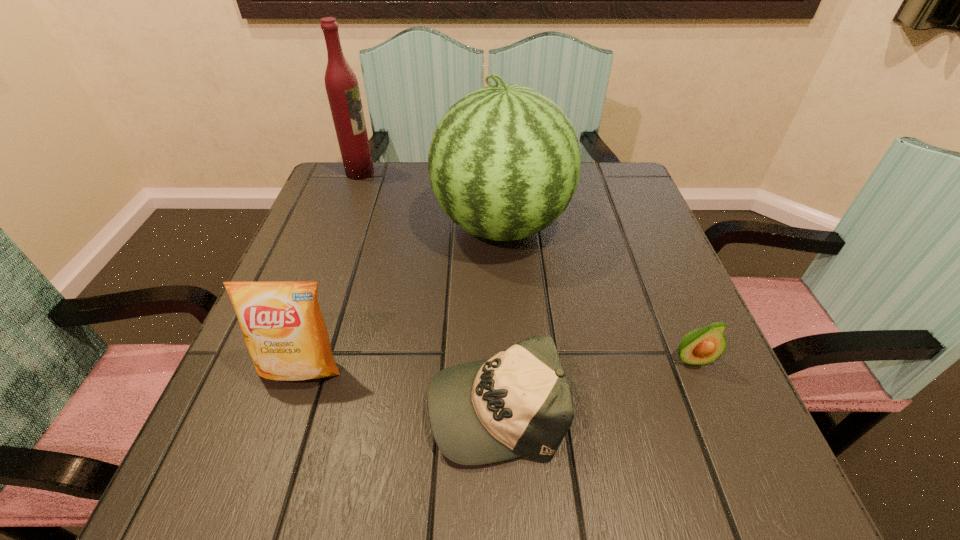
At what (x,y) coordinates should I click in order to perform the action: click on free spot at the right edge of the desktop. Please return your answer as a coordinate pair (x, y). This screenshot has width=960, height=540. Looking at the image, I should click on (650, 346).

At what (x,y) coordinates should I click in order to perform the action: click on free space at the far left corner of the desktop. Please return your answer as a coordinate pair (x, y). The width and height of the screenshot is (960, 540). Looking at the image, I should click on (391, 168).

In the image, there is a desktop. Identify the location of free space at the far right corner. The image size is (960, 540). (601, 178).

This screenshot has width=960, height=540. Find the location of `vacant space that is in between the rightmost object and the shortest object`. vacant space that is in between the rightmost object and the shortest object is located at coordinates (594, 382).

Locate an element on the screen. free area in between the liquor and the rightmost object is located at coordinates (526, 266).

Locate an element on the screen. This screenshot has width=960, height=540. vacant space that's between the rightmost object and the fourth nearest object is located at coordinates (596, 293).

The height and width of the screenshot is (540, 960). In order to click on unoccupied area between the third tallest object and the fourth nearest object in this screenshot , I will do `click(401, 297)`.

Where is `free space between the watermelon and the baseball cap`? free space between the watermelon and the baseball cap is located at coordinates (498, 315).

The width and height of the screenshot is (960, 540). Identify the location of free space between the baseball cap and the watermelon. (498, 315).

This screenshot has height=540, width=960. I want to click on empty space between the farthest object and the rightmost object, so click(x=526, y=266).